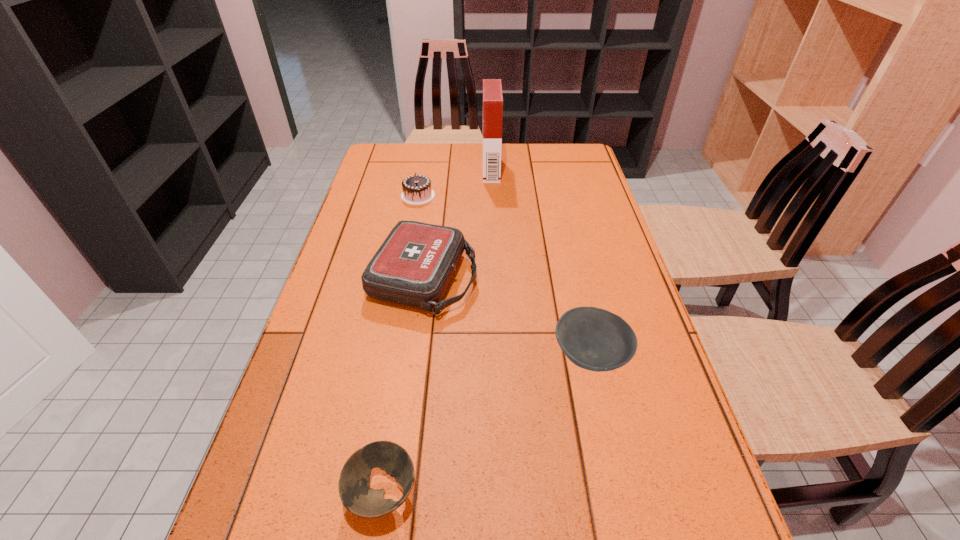
Where is `free area in between the third nearest object and the nearest object`? The image size is (960, 540). free area in between the third nearest object and the nearest object is located at coordinates (403, 385).

You are a GUI agent. You are given a task and a screenshot of the screen. Output one action in this format:
    pyautogui.click(x=<x>, y=<y>)
    Task: Click on the object that is the second closest one to the shorter bowl
    This screenshot has width=960, height=540.
    Given the screenshot: What is the action you would take?
    pyautogui.click(x=414, y=265)

At what (x,y) coordinates should I click in order to perform the action: click on object that is the closest to the farthest object. Please return your answer as a coordinate pair (x, y). Looking at the image, I should click on (417, 190).

Locate an element on the screen. Image resolution: width=960 pixels, height=540 pixels. vacant space that satisfies the following two spatial constraints: 1. on the front-facing side of the tallest object; 2. on the front side of the chocolate cake is located at coordinates (492, 195).

Identify the location of vacant point that satisfies the following two spatial constraints: 1. on the front-facing side of the tallest object; 2. on the front side of the nearest object. (503, 492).

Identify the location of free space that satisfies the following two spatial constraints: 1. on the front-facing side of the tallest object; 2. on the front side of the shorter bowl. (503, 492).

Locate an element on the screen. free space that satisfies the following two spatial constraints: 1. on the front-facing side of the rightmost object; 2. on the left side of the farthest object is located at coordinates (498, 356).

Image resolution: width=960 pixels, height=540 pixels. I want to click on vacant region that satisfies the following two spatial constraints: 1. on the front-facing side of the cigarette_case; 2. on the back side of the right bowl, so pyautogui.click(x=498, y=356).